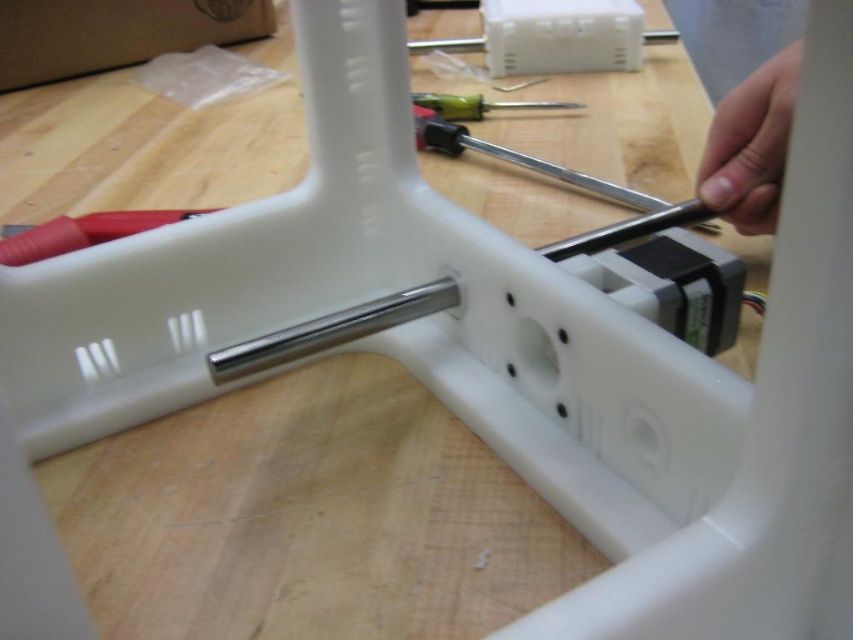
You are an engineer working on assembling the white plastic component. You need to choose the smaller screwdriver to fit into a tight space. Which one should you pick between the smooth silver screwdriver at upper right and the black plastic screwdriver at center?

The smooth silver screwdriver at upper right is smaller than the black plastic screwdriver at center, so you should pick the smooth silver screwdriver at upper right for the tight space.

You are an engineer working on assembling the white plastic component. You need to choose a screwdriver that can fit into a narrow hole in the horizontal bar. Which screwdriver should you pick between the smooth silver screwdriver at upper right and the green plastic screwdriver at center?

The smooth silver screwdriver at upper right is thinner than the green plastic screwdriver at center, so you should pick the smooth silver screwdriver at upper right to fit into the narrow hole.